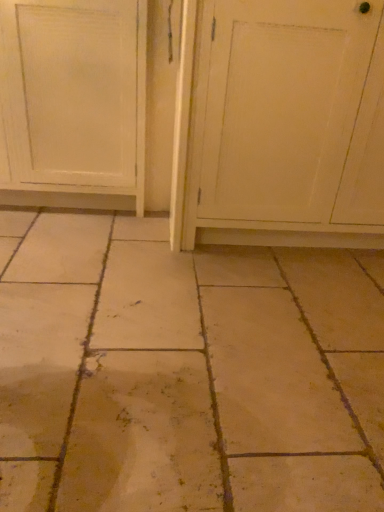
The height and width of the screenshot is (512, 384). Describe the element at coordinates (73, 103) in the screenshot. I see `white painted wood door at left` at that location.

The width and height of the screenshot is (384, 512). I want to click on white painted wood door at left, so click(x=73, y=103).

Looking at this image, what is the approximate width of white wood screen door at center?

white wood screen door at center is 20.48 inches wide.

At what (x,y) coordinates should I click in order to perform the action: click on white wood screen door at center. Please return your answer as a coordinate pair (x, y). Looking at the image, I should click on (292, 113).

The width and height of the screenshot is (384, 512). What do you see at coordinates (292, 113) in the screenshot? I see `white wood screen door at center` at bounding box center [292, 113].

The height and width of the screenshot is (512, 384). Identify the location of white painted wood door at left. (73, 103).

Which is more to the left, white painted wood door at left or white wood screen door at center?

Positioned to the left is white painted wood door at left.

Considering their positions, is white painted wood door at left located in front of or behind white wood screen door at center?

In the image, white painted wood door at left appears behind white wood screen door at center.

Which is nearer, (107,49) or (358,155)?

The point (358,155) is more forward.

From the image's perspective, is white painted wood door at left over white wood screen door at center?

Indeed, from the image's perspective, white painted wood door at left is shown above white wood screen door at center.

From a real-world perspective, relative to white wood screen door at center, is white painted wood door at left vertically above or below?

From a real-world perspective, white painted wood door at left is physically below white wood screen door at center.

Does white painted wood door at left have a greater width compared to white wood screen door at center?

Yes.

Who is taller, white painted wood door at left or white wood screen door at center?

white wood screen door at center is taller.

Which of these two, white painted wood door at left or white wood screen door at center, is smaller?

Smaller between the two is white painted wood door at left.

Would you say white painted wood door at left contains white wood screen door at center?

That's incorrect, white wood screen door at center is not inside white painted wood door at left.

Are white painted wood door at left and white wood screen door at center located far from each other?

Actually, white painted wood door at left and white wood screen door at center are a little close together.

Is white painted wood door at left oriented away from white wood screen door at center?

No, white painted wood door at left is not facing the opposite direction of white wood screen door at center.

How different are the orientations of white painted wood door at left and white wood screen door at center in degrees?

The angle between the facing direction of white painted wood door at left and the facing direction of white wood screen door at center is 0.177 degrees.

Identify the location of door that appears above the white wood screen door at center (from the image's perspective). (73, 103).

Between white wood screen door at center and white painted wood door at left, which one appears on the left side from the viewer's perspective?

From the viewer's perspective, white painted wood door at left appears more on the left side.

Relative to white painted wood door at left, is white wood screen door at center in front or behind?

white wood screen door at center is positioned closer to the viewer than white painted wood door at left.

Considering the points (300, 38) and (18, 126), which point is behind, point (300, 38) or point (18, 126)?

The point (18, 126) is farther.

From the image's perspective, who appears lower, white wood screen door at center or white painted wood door at left?

white wood screen door at center.

From a real-world perspective, does white wood screen door at center sit lower than white painted wood door at left?

No, from a real-world perspective, white wood screen door at center is not under white painted wood door at left.

From the picture: Considering the sizes of white wood screen door at center and white painted wood door at left in the image, is white wood screen door at center wider or thinner than white painted wood door at left?

Clearly, white wood screen door at center has less width compared to white painted wood door at left.

Can you confirm if white wood screen door at center is shorter than white painted wood door at left?

Incorrect, the height of white wood screen door at center does not fall short of that of white painted wood door at left.

Consider the image. Based on their sizes in the image, would you say white wood screen door at center is bigger or smaller than white painted wood door at left?

Considering their sizes, white wood screen door at center takes up more space than white painted wood door at left.

Is white wood screen door at center surrounding white painted wood door at left?

No.

Are white wood screen door at center and white painted wood door at left located far from each other?

No, white wood screen door at center is in close proximity to white painted wood door at left.

Is white wood screen door at center looking in the opposite direction of white painted wood door at left?

white wood screen door at center does not have its back to white painted wood door at left.

How many degrees apart are the facing directions of white wood screen door at center and white painted wood door at left?

The angle between the facing direction of white wood screen door at center and the facing direction of white painted wood door at left is 0.177 degrees.

Find the location of `door behind the white wood screen door at center`. door behind the white wood screen door at center is located at coordinates (73, 103).

Where is `door above the white wood screen door at center (from the image's perspective)`? The image size is (384, 512). door above the white wood screen door at center (from the image's perspective) is located at coordinates (73, 103).

This screenshot has height=512, width=384. What are the coordinates of `screen door in front of the white painted wood door at left` in the screenshot? It's located at (292, 113).